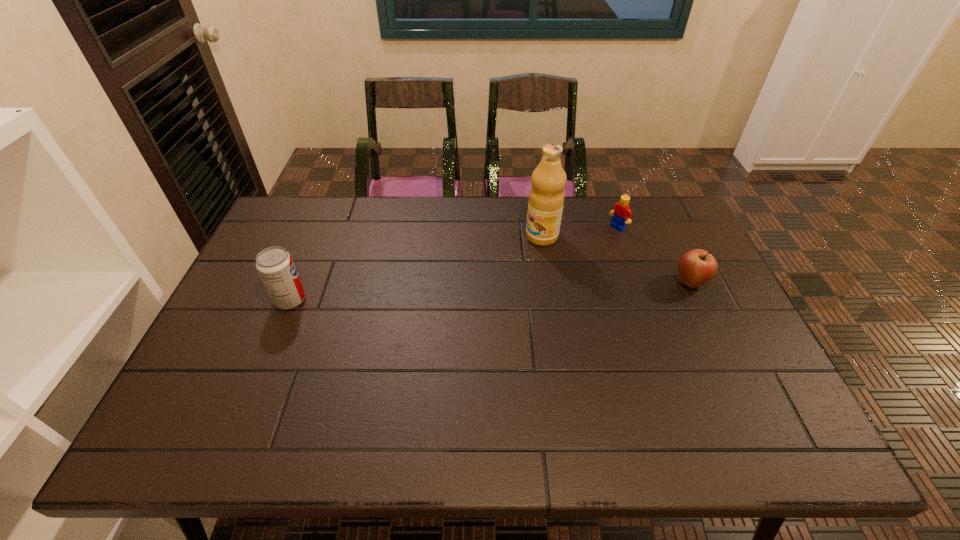
The width and height of the screenshot is (960, 540). I want to click on vacant region located 0.050m on the front-facing side of the Lego, so click(603, 238).

Where is `free region located 0.250m on the label of the olive oil`? Image resolution: width=960 pixels, height=540 pixels. free region located 0.250m on the label of the olive oil is located at coordinates (470, 280).

The image size is (960, 540). I want to click on vacant space situated 0.150m on the label of the olive oil, so (x=495, y=265).

Identify the location of vacant point located on the label of the olive oil. (486, 271).

The height and width of the screenshot is (540, 960). What are the coordinates of `Lego that is at the far edge` in the screenshot? It's located at tap(621, 211).

The height and width of the screenshot is (540, 960). What are the coordinates of `olive oil that is at the far edge` in the screenshot? It's located at (546, 198).

This screenshot has width=960, height=540. What are the coordinates of `object that is at the left edge` in the screenshot? It's located at (275, 265).

I want to click on object that is positioned at the right edge, so click(697, 267).

The height and width of the screenshot is (540, 960). In order to click on blank space at the far edge of the desktop in this screenshot , I will do `click(636, 220)`.

Find the location of a particular element. vacant region at the near edge of the desktop is located at coordinates (379, 377).